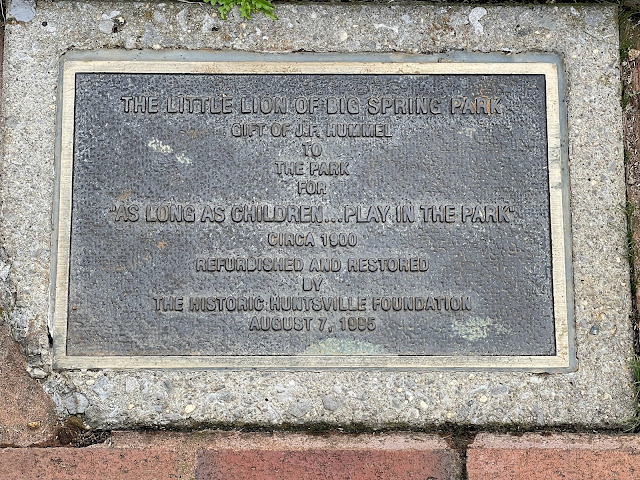
You are a GUI agent. You are given a task and a screenshot of the screen. Output one action in this format:
    pyautogui.click(x=<x>, y=<y>)
    Task: Click on the corners of center section of plaque
    The width and height of the screenshot is (640, 480).
    Given the screenshot: What is the action you would take?
    pyautogui.click(x=77, y=76), pyautogui.click(x=543, y=78), pyautogui.click(x=552, y=352), pyautogui.click(x=68, y=348)